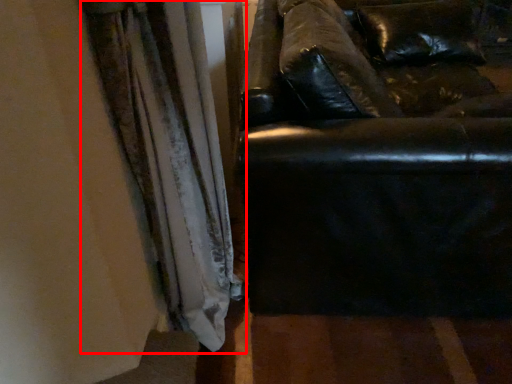
Question: In this image, where is curtain (annotated by the red box) located relative to studio couch?

Choices:
 (A) left
 (B) right

Answer: (A)